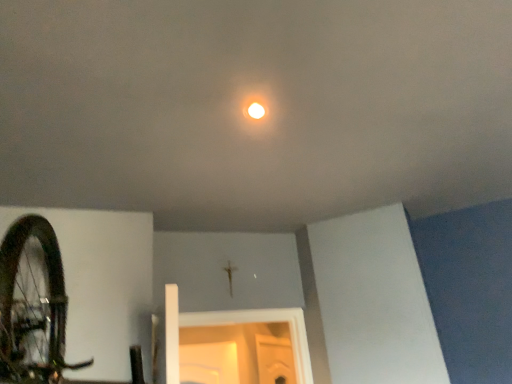
Describe the element at coordinates (255, 108) in the screenshot. Image resolution: width=512 pixels, height=384 pixels. I see `white matte droplight at center` at that location.

You are a GUI agent. You are given a task and a screenshot of the screen. Output one action in this format:
    pyautogui.click(x=<x>, y=<y>)
    Task: Click on the white matte droplight at center
    
    Given the screenshot: What is the action you would take?
    pyautogui.click(x=255, y=108)

This screenshot has height=384, width=512. Identify the location of white matte droplight at center. (255, 108).